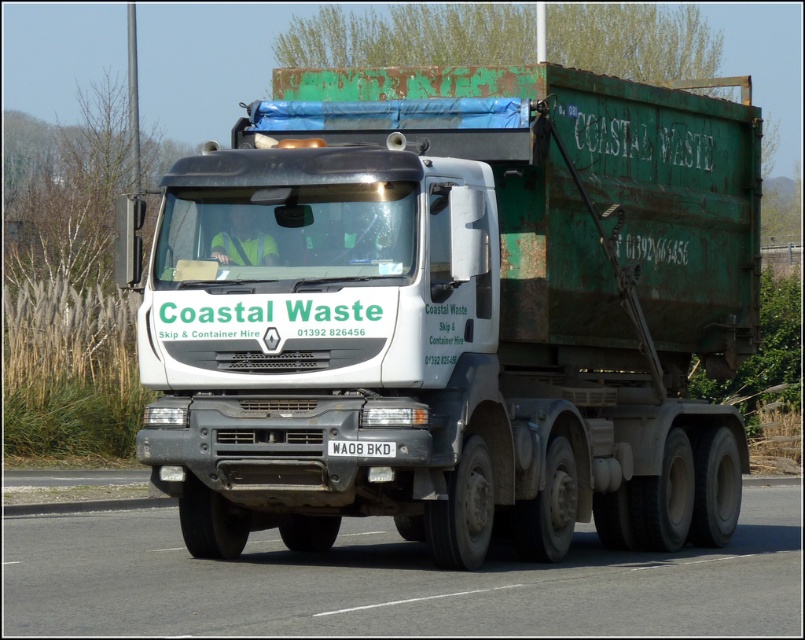
Question: Does white matte truck at center appear on the right side of gray asphalt road at center?

Choices:
 (A) no
 (B) yes

Answer: (A)

Question: Which object is the closest to the gray asphalt road at center?

Choices:
 (A) white rectangular at center
 (B) white matte truck at center

Answer: (A)

Question: From the image, what is the correct spatial relationship of gray asphalt road at center in relation to white rectangular at center?

Choices:
 (A) below
 (B) above

Answer: (A)

Question: Which object is farther from the camera taking this photo?

Choices:
 (A) white matte truck at center
 (B) white rectangular at center

Answer: (A)

Question: Can you confirm if gray asphalt road at center is positioned below white rectangular at center?

Choices:
 (A) yes
 (B) no

Answer: (A)

Question: Estimate the real-world distances between objects in this image. Which object is closer to the gray asphalt road at center?

Choices:
 (A) white rectangular at center
 (B) white matte truck at center

Answer: (A)